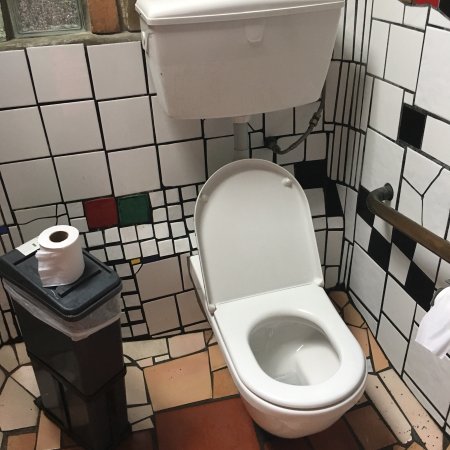
Point to all occurrences of what you'd sit on in the image. Your answer should be formatted as a list of tuples, i.e. [(x1, y1), (x2, y2), ...], where each tuple contains the x and y coordinates of a point satisfying the conditions above.

[(249, 368)]